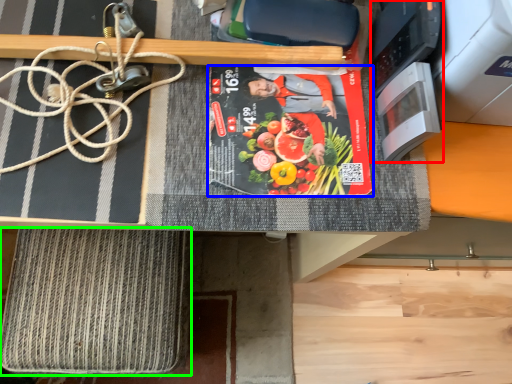
Question: Considering the real-world distances, which object is farthest from appliance (highlighted by a red box)? paperback book (highlighted by a blue box) or yoga mat (highlighted by a green box)?

Choices:
 (A) paperback book
 (B) yoga mat

Answer: (B)